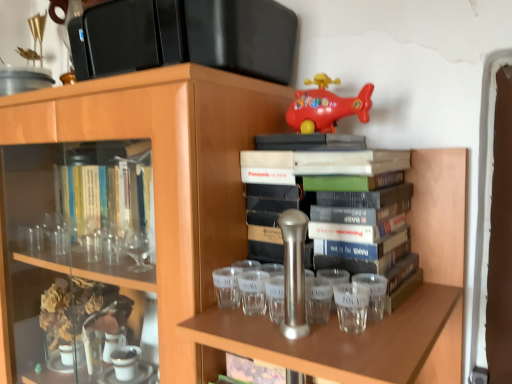
At what (x,y) coordinates should I click in order to perform the action: click on hardcover book at center. Please return your answer as a coordinate pair (x, y). Looking at the image, I should click on (340, 201).

In order to face hardcover book at center, should I rotate leftwards or rightwards?

Rotate your view right by about 13.821°.

Measure the distance between point [243,301] and camera.

They are 25.94 inches apart.

At what (x,y) coordinates should I click in order to perform the action: click on transparent glass shot glass at center, which ranks as the second shot glass in right-to-left order. Please return your answer as a coordinate pair (x, y). The height and width of the screenshot is (384, 512). Looking at the image, I should click on (253, 292).

In order to click on transparent glass shot glass at right, the first shot glass from the right in this screenshot , I will do `click(374, 294)`.

Is point (236, 302) closer or farther from the camera than point (244, 163)?

Point (236, 302).

From the image's perspective, is transparent glass shot glass at center, the third shot glass positioned from the right, located above hardcover book at center?

No, from the image's perspective, transparent glass shot glass at center, the third shot glass positioned from the right, is not on top of hardcover book at center.

Where is `book above the transparent glass shot glass at center, which ranks as the 1th shot glass in left-to-right order (from the image's perspective)`? book above the transparent glass shot glass at center, which ranks as the 1th shot glass in left-to-right order (from the image's perspective) is located at coordinates (340, 201).

Based on their sizes in the image, would you say transparent glass shot glass at center, the third shot glass positioned from the right, is bigger or smaller than hardcover book at center?

transparent glass shot glass at center, the third shot glass positioned from the right, is smaller than hardcover book at center.

This screenshot has height=384, width=512. I want to click on the 1st shot glass counting from the left of the rubber red airplane at upper center, so click(253, 292).

Is rubber red airplane at upper center oriented away from transparent glass shot glass at center, the second shot glass in the left-to-right sequence?

No, rubber red airplane at upper center's orientation is not away from transparent glass shot glass at center, the second shot glass in the left-to-right sequence.

Looking at this image, is the depth of rubber red airplane at upper center less than that of transparent glass shot glass at center, which ranks as the second shot glass in right-to-left order?

No, rubber red airplane at upper center is behind transparent glass shot glass at center, which ranks as the second shot glass in right-to-left order.

Does point (325, 79) come in front of point (252, 294)?

No, it is behind (252, 294).

How much distance is there between transparent glass shot glass at center, which ranks as the second shot glass in right-to-left order, and hardcover book at center?

transparent glass shot glass at center, which ranks as the second shot glass in right-to-left order, and hardcover book at center are 6.82 inches apart.

Identify the location of book positioned vertically above the transparent glass shot glass at center, which ranks as the second shot glass in right-to-left order (from a real-world perspective). (340, 201).

Is transparent glass shot glass at center, which ranks as the second shot glass in right-to-left order, taller than hardcover book at center?

No, transparent glass shot glass at center, which ranks as the second shot glass in right-to-left order, is not taller than hardcover book at center.

Which object is more forward, transparent glass shot glass at center, which ranks as the second shot glass in right-to-left order, or hardcover book at center?

hardcover book at center is more forward.

Looking at this image, in the image, is transparent glass shot glass at right, the 3th shot glass viewed from the left, positioned in front of or behind transparent glass shot glass at center, which ranks as the 1th shot glass in left-to-right order?

transparent glass shot glass at right, the 3th shot glass viewed from the left, is positioned closer to the viewer than transparent glass shot glass at center, which ranks as the 1th shot glass in left-to-right order.

Which point is more distant from viewer, (374, 309) or (223, 271)?

The point (223, 271) is farther.

From the image's perspective, is transparent glass shot glass at right, the first shot glass from the right, on top of transparent glass shot glass at center, which ranks as the 1th shot glass in left-to-right order?

Incorrect, from the image's perspective, transparent glass shot glass at right, the first shot glass from the right, is lower than transparent glass shot glass at center, which ranks as the 1th shot glass in left-to-right order.

Does transparent glass shot glass at right, the 3th shot glass viewed from the left, appear on the left side of transparent glass shot glass at center, which ranks as the 1th shot glass in left-to-right order?

Incorrect, transparent glass shot glass at right, the 3th shot glass viewed from the left, is not on the left side of transparent glass shot glass at center, which ranks as the 1th shot glass in left-to-right order.

Considering the relative sizes of transparent glass shot glass at center, which ranks as the second shot glass in right-to-left order, and transparent glass shot glass at center, the third shot glass positioned from the right, in the image provided, is transparent glass shot glass at center, which ranks as the second shot glass in right-to-left order, bigger than transparent glass shot glass at center, the third shot glass positioned from the right,?

Yes.

At what (x,y) coordinates should I click in order to perform the action: click on shot glass behind the transparent glass shot glass at center, which ranks as the second shot glass in right-to-left order. Please return your answer as a coordinate pair (x, y). Looking at the image, I should click on (227, 287).

Is transparent glass shot glass at center, which ranks as the second shot glass in right-to-left order, turned away from transparent glass shot glass at center, the third shot glass positioned from the right?

No, transparent glass shot glass at center, which ranks as the second shot glass in right-to-left order, is not facing the opposite direction of transparent glass shot glass at center, the third shot glass positioned from the right.

Considering the positions of points (247, 300) and (216, 294), is point (247, 300) farther from camera compared to point (216, 294)?

No.

Is hardcover book at center not close to rubber red airplane at upper center?

Actually, hardcover book at center and rubber red airplane at upper center are a little close together.

Consider the image. Considering the sizes of hardcover book at center and rubber red airplane at upper center in the image, is hardcover book at center wider or thinner than rubber red airplane at upper center?

In the image, hardcover book at center appears to be wider than rubber red airplane at upper center.

From the image's perspective, is hardcover book at center under rubber red airplane at upper center?

Yes, from the image's perspective, hardcover book at center is below rubber red airplane at upper center.

Which object is positioned more to the left, rubber red airplane at upper center or transparent glass shot glass at center, the third shot glass positioned from the right?

Positioned to the left is transparent glass shot glass at center, the third shot glass positioned from the right.

Identify the location of the 3rd shot glass positioned below the rubber red airplane at upper center (from a real-world perspective). (227, 287).

Find the location of `book located above the transparent glass shot glass at center, the third shot glass positioned from the right (from a real-world perspective)`. book located above the transparent glass shot glass at center, the third shot glass positioned from the right (from a real-world perspective) is located at coordinates (340, 201).

At what (x,y) coordinates should I click in order to perform the action: click on toy that appears on the right of transparent glass shot glass at center, the second shot glass in the left-to-right sequence. Please return your answer as a coordinate pair (x, y). Looking at the image, I should click on (326, 106).

Looking at the image, which one is located further to hardcover book at center, rubber red airplane at upper center or transparent glass shot glass at right, the first shot glass from the right?

rubber red airplane at upper center is further to hardcover book at center.

From the picture: From the image, which object appears to be farther from hardcover book at center, transparent glass shot glass at center, the third shot glass positioned from the right, or transparent glass shot glass at right, the 3th shot glass viewed from the left?

transparent glass shot glass at center, the third shot glass positioned from the right, lies further to hardcover book at center than the other object.

Consider the image. From the image, which object appears to be nearer to rubber red airplane at upper center, transparent glass shot glass at right, the 3th shot glass viewed from the left, or transparent glass shot glass at center, which ranks as the 1th shot glass in left-to-right order?

Based on the image, transparent glass shot glass at right, the 3th shot glass viewed from the left, appears to be nearer to rubber red airplane at upper center.

Estimate the real-world distances between objects in this image. Which object is closer to transparent glass shot glass at right, the 3th shot glass viewed from the left, rubber red airplane at upper center or transparent glass shot glass at center, the second shot glass in the left-to-right sequence?

Among the two, transparent glass shot glass at center, the second shot glass in the left-to-right sequence, is located nearer to transparent glass shot glass at right, the 3th shot glass viewed from the left.

Looking at the image, which one is located further to rubber red airplane at upper center, transparent glass shot glass at center, which ranks as the second shot glass in right-to-left order, or hardcover book at center?

transparent glass shot glass at center, which ranks as the second shot glass in right-to-left order, is further to rubber red airplane at upper center.

Based on their spatial positions, is transparent glass shot glass at center, which ranks as the second shot glass in right-to-left order, or hardcover book at center further from transparent glass shot glass at right, the first shot glass from the right?

The object further to transparent glass shot glass at right, the first shot glass from the right, is transparent glass shot glass at center, which ranks as the second shot glass in right-to-left order.

Which object lies further to the anchor point transparent glass shot glass at right, the 3th shot glass viewed from the left, transparent glass shot glass at center, which ranks as the 1th shot glass in left-to-right order, or rubber red airplane at upper center?

rubber red airplane at upper center is further to transparent glass shot glass at right, the 3th shot glass viewed from the left.

Looking at the image, which one is located closer to transparent glass shot glass at center, the third shot glass positioned from the right, transparent glass shot glass at center, which ranks as the second shot glass in right-to-left order, or hardcover book at center?

Based on the image, transparent glass shot glass at center, which ranks as the second shot glass in right-to-left order, appears to be nearer to transparent glass shot glass at center, the third shot glass positioned from the right.

The image size is (512, 384). I want to click on book that lies between rubber red airplane at upper center and transparent glass shot glass at right, the 3th shot glass viewed from the left, from top to bottom, so click(x=340, y=201).

Where is `shot glass between transparent glass shot glass at center, which ranks as the second shot glass in right-to-left order, and hardcover book at center from left to right`? This screenshot has width=512, height=384. shot glass between transparent glass shot glass at center, which ranks as the second shot glass in right-to-left order, and hardcover book at center from left to right is located at coordinates (374, 294).

At what (x,y) coordinates should I click in order to perform the action: click on shot glass between transparent glass shot glass at center, which ranks as the 1th shot glass in left-to-right order, and transparent glass shot glass at right, the first shot glass from the right, in the horizontal direction. Please return your answer as a coordinate pair (x, y). Looking at the image, I should click on (253, 292).

Where is `shot glass between rubber red airplane at upper center and transparent glass shot glass at center, which ranks as the 1th shot glass in left-to-right order, in the up-down direction`? shot glass between rubber red airplane at upper center and transparent glass shot glass at center, which ranks as the 1th shot glass in left-to-right order, in the up-down direction is located at coordinates (253, 292).